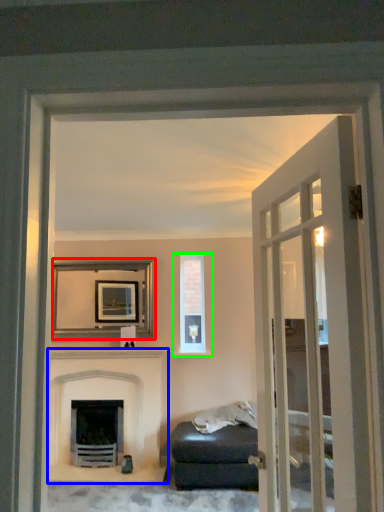
Question: Which object is the farthest from picture frame (highlighted by a red box)? Choose among these: fireplace (highlighted by a blue box) or window (highlighted by a green box).

Choices:
 (A) fireplace
 (B) window

Answer: (B)